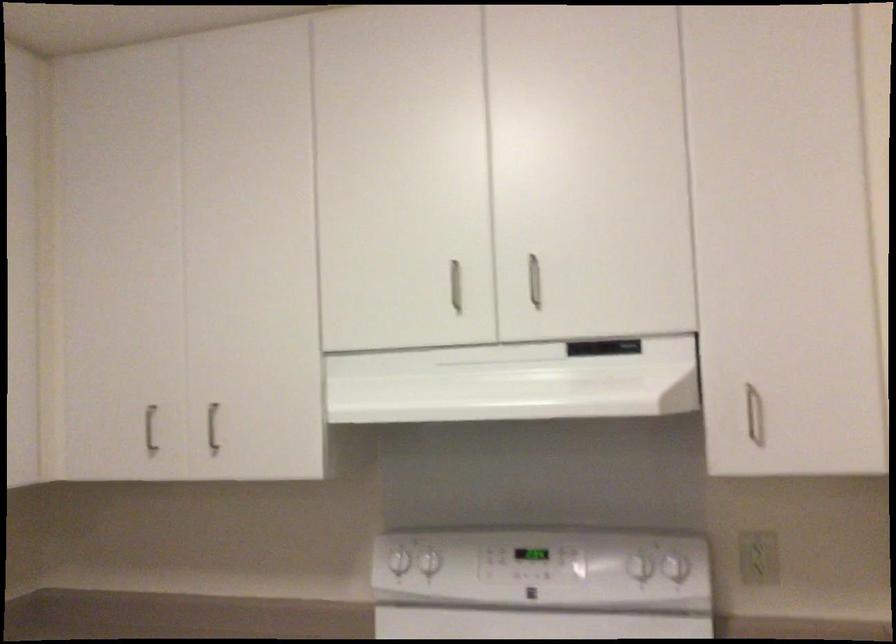
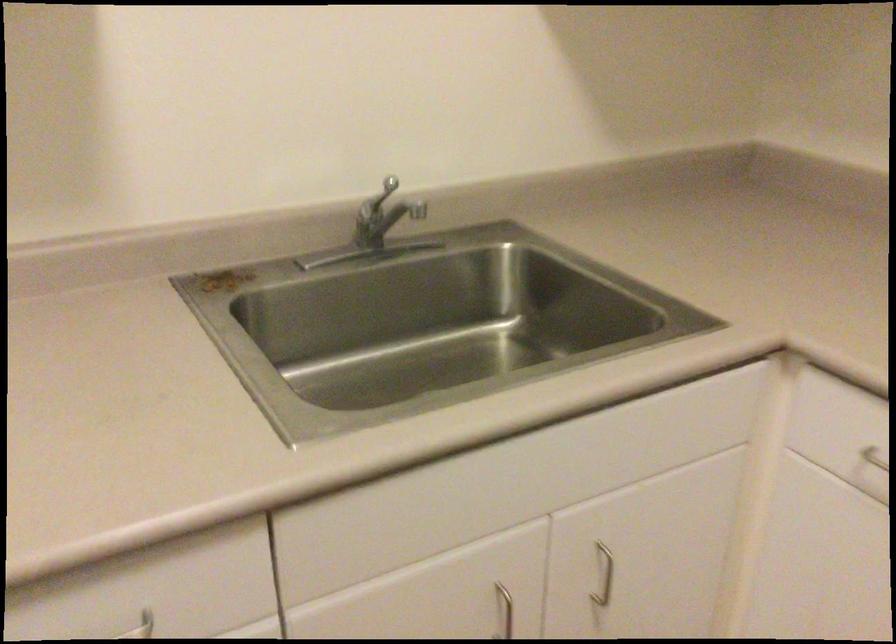
The images are taken continuously from a first-person perspective. In which direction is your viewpoint rotating?

The camera rotated toward left-down.